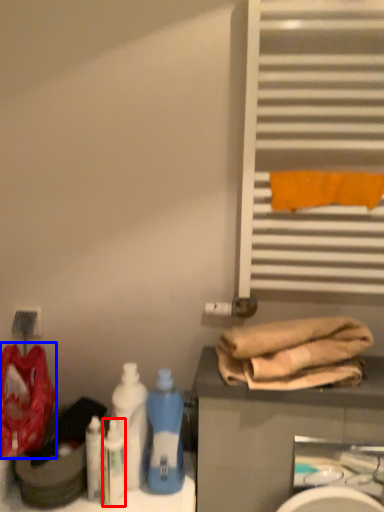
Question: Which object is further to the camera taking this photo, cleaning product (highlighted by a red box) or material (highlighted by a blue box)?

Choices:
 (A) cleaning product
 (B) material

Answer: (A)